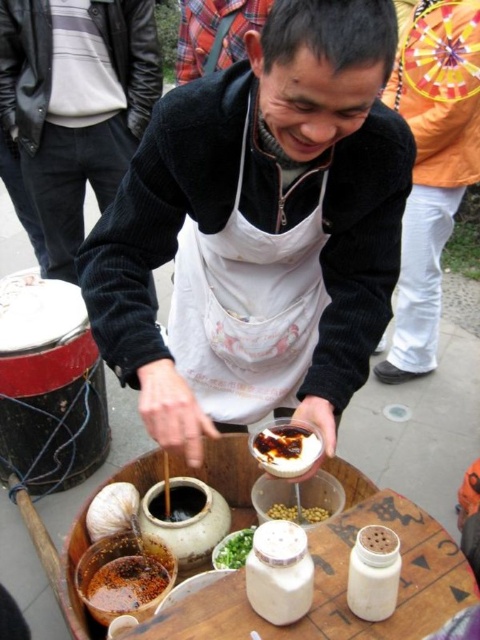
You are a customer observing the street food vendor. You notice the white matte apron at center and the brown matte sauce at center. Which object is positioned to the right side?

The white matte apron at center is positioned to the right of the brown matte sauce at center.

You are a customer standing at the point marked by the coordinate point at (280, 442). You want to grab the container of green herbs. Which direction should you move to reach it?

The container of green herbs is located at the coordinate point at (280, 442). Since you are already at that point, you don not need to move further to reach it.

You are a customer at the food stall and want to pour the savory brown sauce at center into the brown matte clay pot at lower left. Is the pot wide enough to hold the sauce without spilling?

The savory brown sauce at center is thinner than brown matte clay pot at lower left, so the pot is wide enough to hold the sauce without spilling.